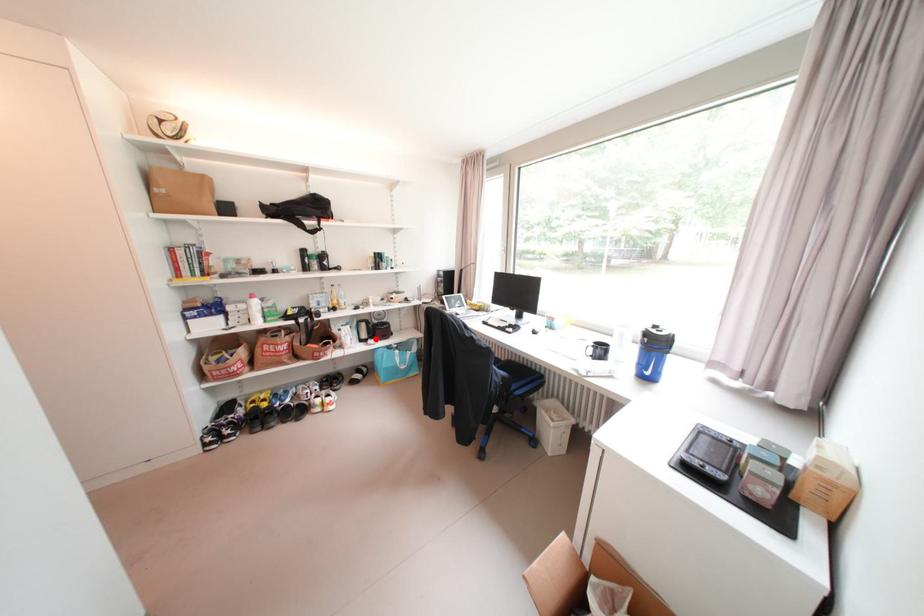
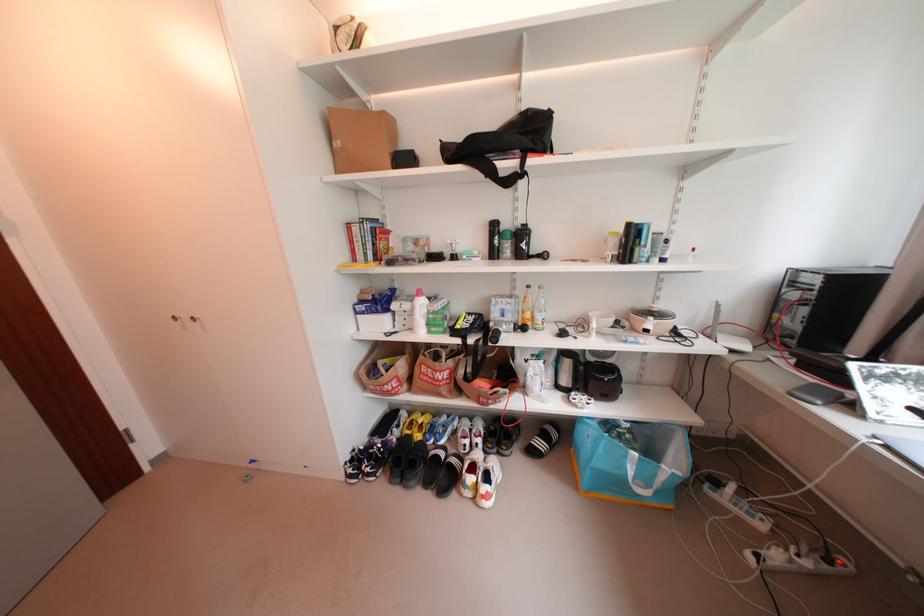
Question: I am providing you with two images of the same scene from different viewpoints. A red point is shown in image1. For the corresponding object point in image2, is it positioned nearer or farther from the camera?

Choices:
 (A) Nearer
 (B) Farther

Answer: (B)